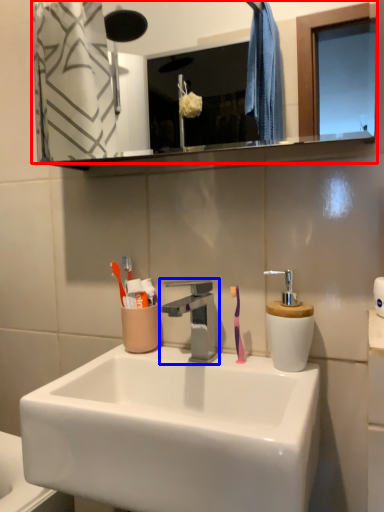
Question: Among these objects, which one is farthest to the camera, mirror (highlighted by a red box) or tap (highlighted by a blue box)?

Choices:
 (A) mirror
 (B) tap

Answer: (B)